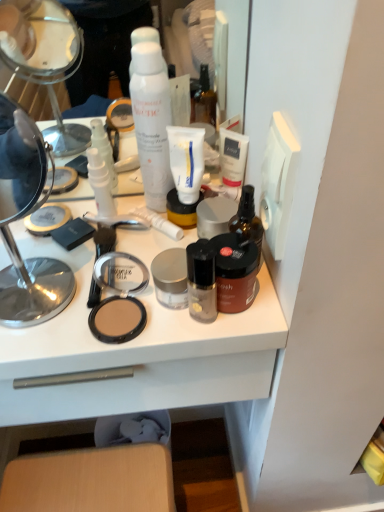
The height and width of the screenshot is (512, 384). I want to click on free space to the back side of metallic silver magnifying glass at left, so click(64, 232).